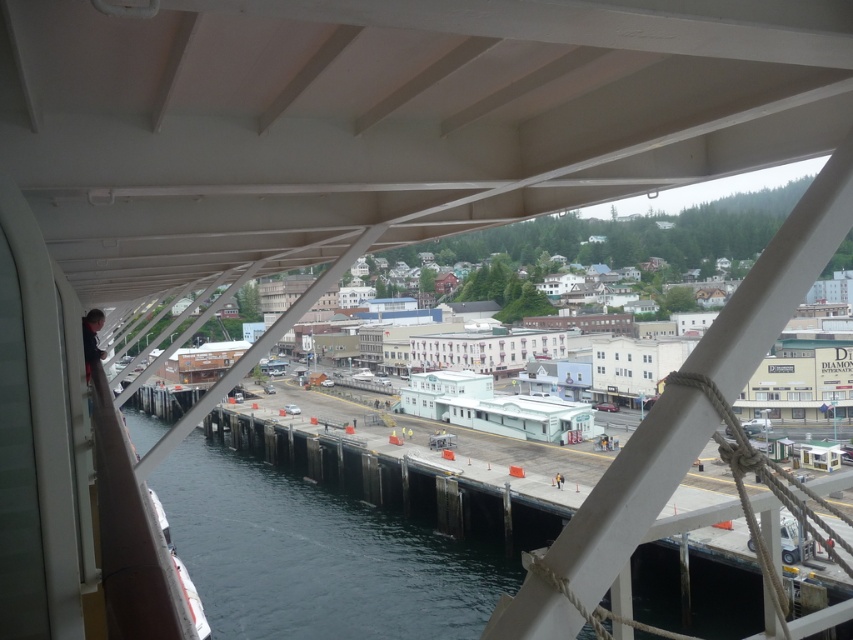
You are a crane operator who needs to lower a 70 meter long steel beam from the white matte beam at upper right to the dark blue water at lower left. Can you safely lower the beam without it touching anything?

The distance between the white matte beam at upper right and the dark blue water at lower left is 70.74 meters. Since the steel beam is 70 meters long, it can be lowered safely as there is enough space between them.

You are standing inside the ferry and looking through the window. There are two points marked on the glass at point coordinates point (236, 513) and point (724, 342). Which point is closer to you?

Point (236, 513) is further to the camera than point (724, 342). Therefore, point (724, 342) is closer to you.